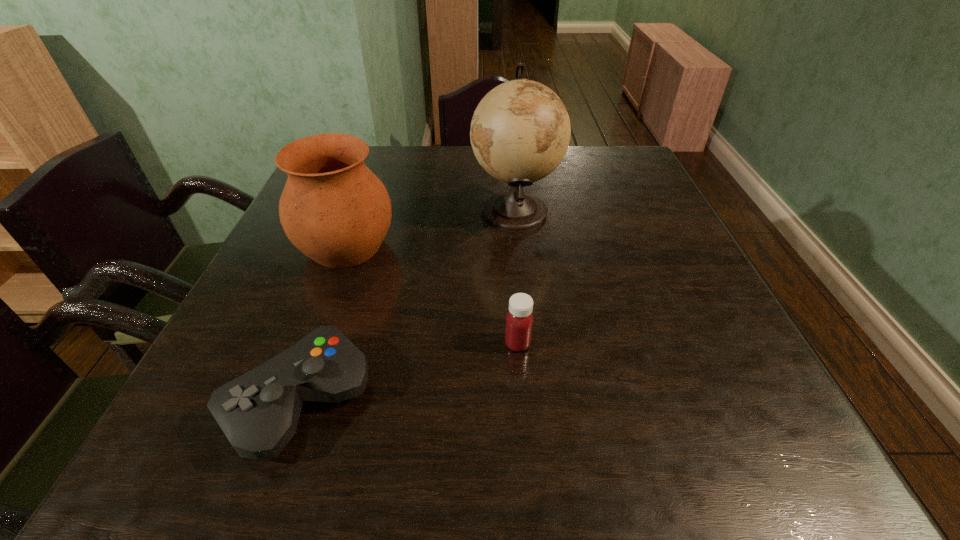
The height and width of the screenshot is (540, 960). I want to click on the tallest object, so click(x=520, y=131).

Image resolution: width=960 pixels, height=540 pixels. In order to click on pottery in this screenshot , I will do `click(334, 209)`.

Find the location of a particular element. The width and height of the screenshot is (960, 540). medicine is located at coordinates (x=519, y=321).

The image size is (960, 540). I want to click on control, so click(258, 412).

Image resolution: width=960 pixels, height=540 pixels. Find the location of `vacant space located on the front-facing side of the tallest object`. vacant space located on the front-facing side of the tallest object is located at coordinates (381, 211).

At what (x,y) coordinates should I click in order to perform the action: click on free space located on the front-facing side of the tallest object. Please return your answer as a coordinate pair (x, y). Looking at the image, I should click on (362, 211).

Where is `vacant space located on the front-facing side of the tallest object`? This screenshot has height=540, width=960. vacant space located on the front-facing side of the tallest object is located at coordinates (393, 211).

Where is `vacant space located 0.100m on the right of the pottery`? The height and width of the screenshot is (540, 960). vacant space located 0.100m on the right of the pottery is located at coordinates (440, 246).

You are a GUI agent. You are given a task and a screenshot of the screen. Output one action in this format:
    pyautogui.click(x=<x>, y=<y>)
    Task: Click on the free space located 0.260m on the left of the third tallest object
    The height and width of the screenshot is (540, 960).
    Given the screenshot: What is the action you would take?
    click(362, 343)

You are a GUI agent. You are given a task and a screenshot of the screen. Output one action in this format:
    pyautogui.click(x=<x>, y=<y>)
    Task: Click on the vacant area located on the right of the control
    The height and width of the screenshot is (540, 960).
    Given the screenshot: What is the action you would take?
    pyautogui.click(x=399, y=400)